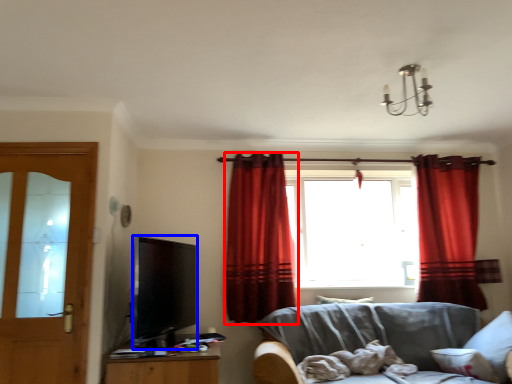
Question: Which object is closer to the camera taking this photo, curtain (highlighted by a red box) or television (highlighted by a blue box)?

Choices:
 (A) curtain
 (B) television

Answer: (B)